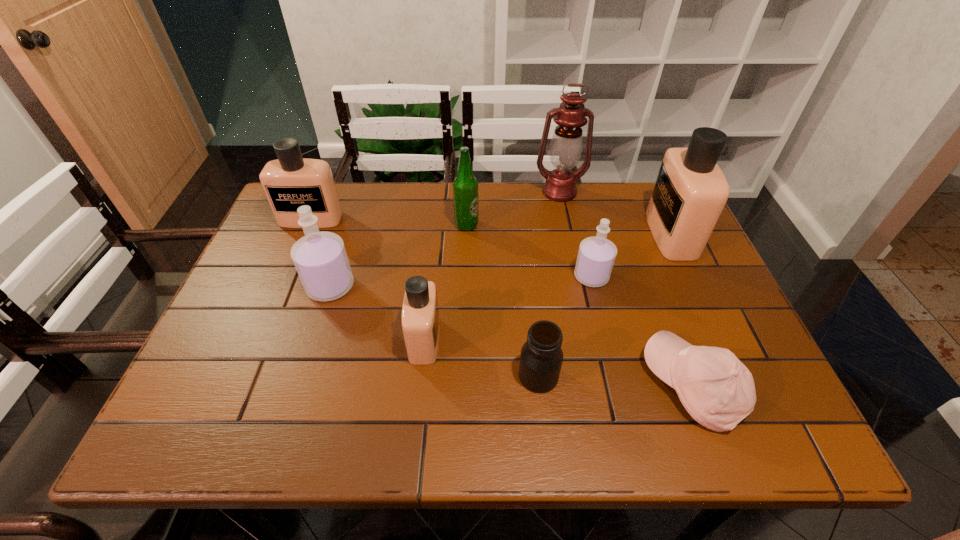
I want to click on the smaller purple perfume, so click(x=596, y=256).

The image size is (960, 540). In order to click on the right purple perfume in this screenshot , I will do `click(596, 256)`.

I want to click on the fifth object from right to left, so click(x=541, y=357).

Where is `the eighth tallest object`? The width and height of the screenshot is (960, 540). the eighth tallest object is located at coordinates (541, 357).

This screenshot has height=540, width=960. In order to click on baseball cap in this screenshot , I will do `click(718, 391)`.

This screenshot has height=540, width=960. I want to click on the shortest object, so click(718, 391).

Find the location of a particular element. free point located on the right of the oil lamp is located at coordinates (614, 192).

Image resolution: width=960 pixels, height=540 pixels. I want to click on free location located 0.130m on the front label of the rightmost perfume, so click(605, 234).

This screenshot has height=540, width=960. I want to click on vacant space positioned 0.280m on the front label of the rightmost perfume, so click(550, 234).

At what (x,y) coordinates should I click in order to perform the action: click on free space located on the front label of the rightmost perfume. Please return your answer as a coordinate pair (x, y). Looking at the image, I should click on tap(597, 234).